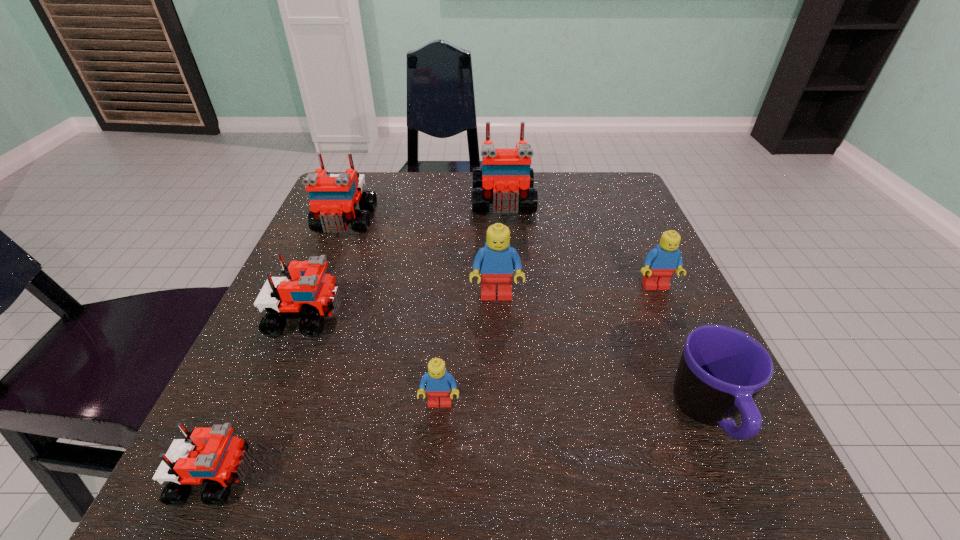
Where is `the biggest red Lego`? the biggest red Lego is located at coordinates (505, 179).

Locate an element on the screen. This screenshot has height=540, width=960. the tallest object is located at coordinates (505, 179).

Find the location of `the second biggest red Lego`. the second biggest red Lego is located at coordinates (334, 197).

Locate an element on the screen. The image size is (960, 540). the biggest blue Lego is located at coordinates (496, 261).

The image size is (960, 540). Find the location of `the rightmost blue Lego`. the rightmost blue Lego is located at coordinates (661, 262).

You are a GUI agent. You are given a task and a screenshot of the screen. Output one action in this format:
    pyautogui.click(x=<x>, y=<y>)
    Task: Click on the second biggest blue Lego
    The image size is (960, 540).
    Given the screenshot: What is the action you would take?
    pyautogui.click(x=661, y=262)

You are a GUI agent. You are given a task and a screenshot of the screen. Output one action in this format:
    pyautogui.click(x=<x>, y=<y>)
    Task: Click on the second nearest red Lego
    
    Given the screenshot: What is the action you would take?
    pyautogui.click(x=316, y=294)

This screenshot has height=540, width=960. I want to click on mug, so click(x=721, y=370).

Identify the location of the smallest blue Lego. (438, 382).

You are a GUI agent. You are given a task and a screenshot of the screen. Output one action in this format:
    pyautogui.click(x=<x>, y=<y>)
    Task: Click on the leftmost blue Lego
    
    Given the screenshot: What is the action you would take?
    pyautogui.click(x=438, y=382)